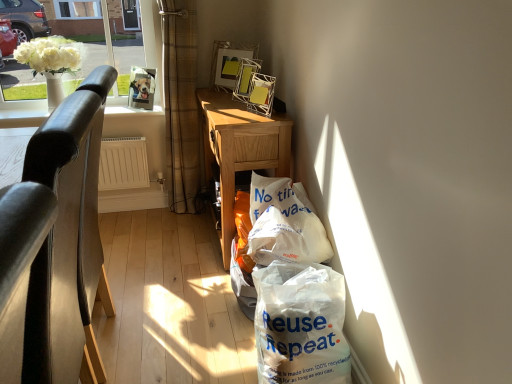
At what (x,y) coordinates should I click in order to perform the action: click on free space in front of wooden desk at center. Please return your answer as a coordinate pair (x, y). The width and height of the screenshot is (512, 384). Looking at the image, I should click on (186, 292).